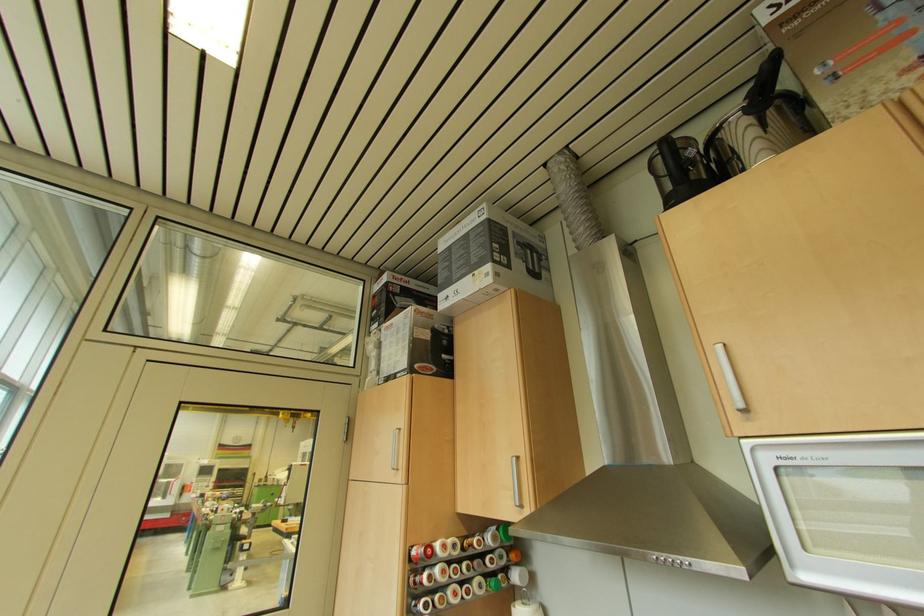
Find the location of a particular element. The height and width of the screenshot is (616, 924). orange spice container is located at coordinates (513, 408).